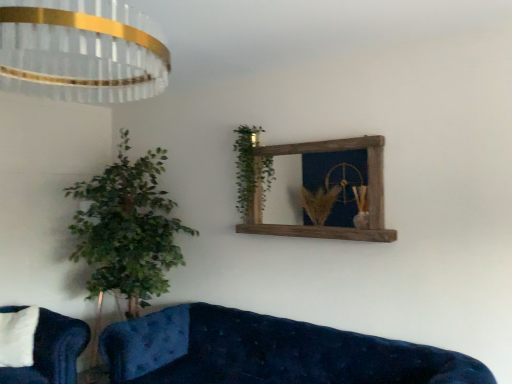
Question: In terms of size, does rustic wood mirror at upper center appear bigger or smaller than green leafy plant at left?

Choices:
 (A) small
 (B) big

Answer: (A)

Question: From a real-world perspective, is rustic wood mirror at upper center physically located above or below green leafy plant at left?

Choices:
 (A) above
 (B) below

Answer: (A)

Question: Based on their relative distances, which object is nearer to the rustic wood mirror at upper center?

Choices:
 (A) crystal glass chandelier at upper left
 (B) green leafy plant at upper center
 (C) green leafy plant at left
 (D) velvet blue studio couch at lower left, the 2th studio couch in the right-to-left sequence
 (E) velvet blue couch at lower center, marked as the 1th studio couch in a front-to-back arrangement

Answer: (B)

Question: Based on their relative distances, which object is farther from the rustic wood mirror at upper center?

Choices:
 (A) velvet blue couch at lower center, the second studio couch from the back
 (B) crystal glass chandelier at upper left
 (C) velvet blue studio couch at lower left, the 2th studio couch positioned from the front
 (D) green leafy plant at left
 (E) green leafy plant at upper center

Answer: (C)